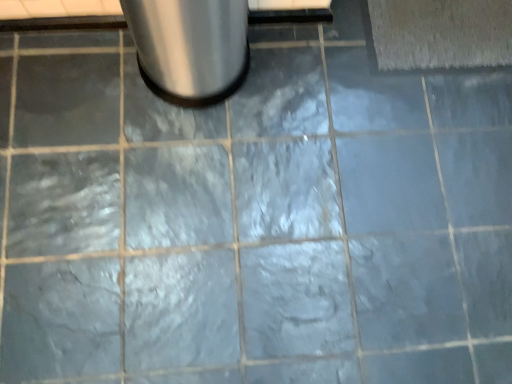
Question: In the image, is beige textured bath mat at upper right on the left side or the right side of satin silver trash can at upper left?

Choices:
 (A) left
 (B) right

Answer: (B)

Question: Is beige textured bath mat at upper right in front of or behind satin silver trash can at upper left in the image?

Choices:
 (A) front
 (B) behind

Answer: (B)

Question: From the image's perspective, relative to satin silver trash can at upper left, is beige textured bath mat at upper right above or below?

Choices:
 (A) above
 (B) below

Answer: (A)

Question: In terms of height, does satin silver trash can at upper left look taller or shorter compared to beige textured bath mat at upper right?

Choices:
 (A) tall
 (B) short

Answer: (A)

Question: In terms of size, does satin silver trash can at upper left appear bigger or smaller than beige textured bath mat at upper right?

Choices:
 (A) small
 (B) big

Answer: (B)

Question: Is point (153, 13) closer or farther from the camera than point (374, 8)?

Choices:
 (A) closer
 (B) farther

Answer: (A)

Question: Do you think satin silver trash can at upper left is within beige textured bath mat at upper right, or outside of it?

Choices:
 (A) inside
 (B) outside

Answer: (B)